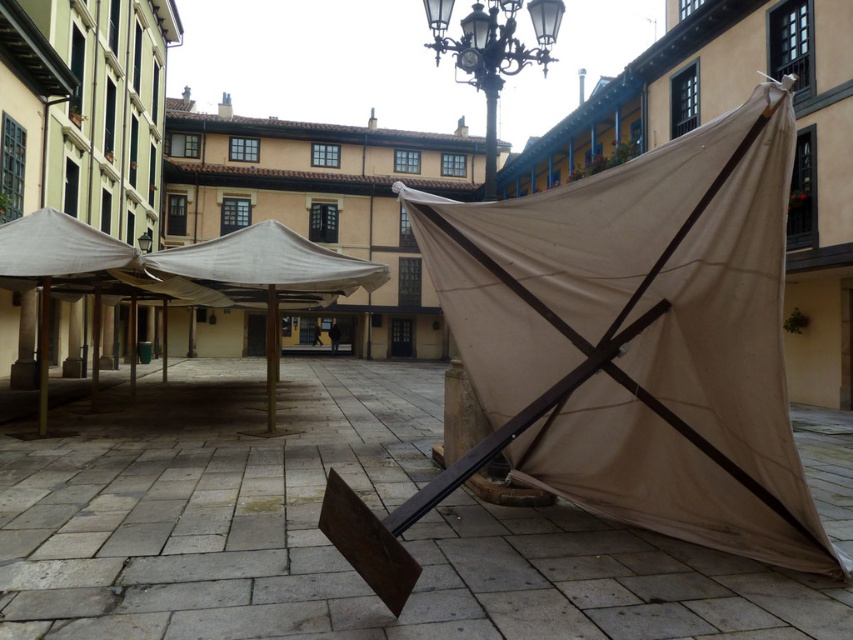
Is matte brown tent at center bigger than white fabric umbrella at center?

No.

Who is more distant from viewer, [73,545] or [242,240]?

Point [242,240]

Where is `matte brown tent at center`? This screenshot has height=640, width=853. matte brown tent at center is located at coordinates (325, 538).

What do you see at coordinates (492, 52) in the screenshot?
I see `black wrought iron streetlight at upper center` at bounding box center [492, 52].

Is black wrought iron streetlight at upper center shorter than metallic streetlight at center?

Yes, black wrought iron streetlight at upper center is shorter than metallic streetlight at center.

Between point (473, 13) and point (489, 198), which one is positioned behind?

Point (489, 198)

At what (x,y) coordinates should I click in order to perform the action: click on black wrought iron streetlight at upper center. Please return your answer as a coordinate pair (x, y). This screenshot has width=853, height=640. Looking at the image, I should click on (492, 52).

Who is taller, white fabric umbrella at center or black wrought iron streetlight at upper center?

With more height is black wrought iron streetlight at upper center.

Between point (349, 292) and point (488, 99), which one is positioned behind?

The point (349, 292) is behind.

Which is behind, point (152, 262) or point (469, 65)?

The point (152, 262) is more distant.

Locate an element on the screen. The height and width of the screenshot is (640, 853). white fabric umbrella at center is located at coordinates point(260,278).